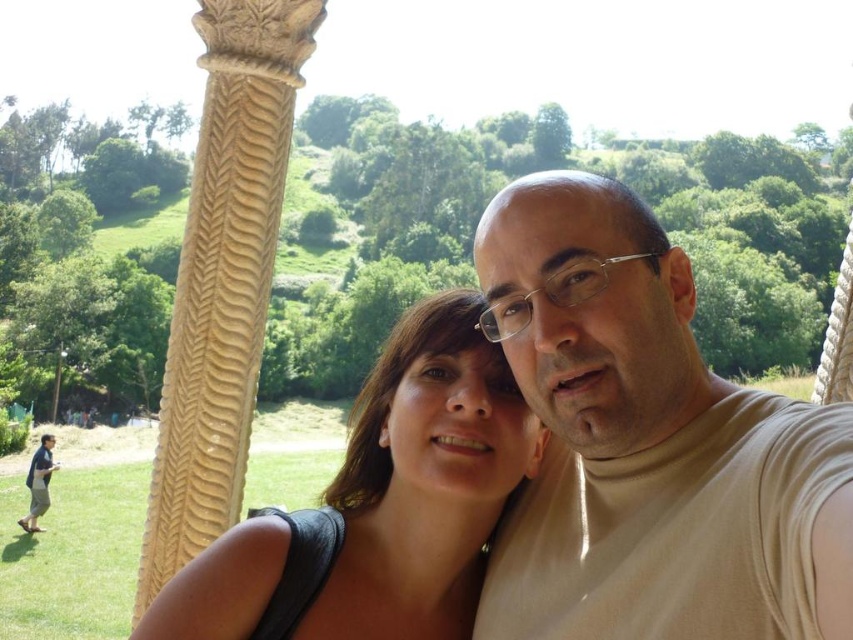
You are a photographer trying to adjust the lighting for a portrait. You notice the beige turtleneck at center and the blue denim jeans at lower left in the scene. Which clothing item requires more careful lighting adjustments due to its smaller size?

The beige turtleneck at center requires more careful lighting adjustments because it has a smaller size compared to the blue denim jeans at lower left, making it more challenging to highlight details in a smaller area.

You are a photographer trying to frame a shot of the beige turtleneck at center and the blue denim jeans at lower left. Which object should you focus on first if you want to capture both in the same frame without zooming in or out?

The beige turtleneck at center has a lesser width compared to blue denim jeans at lower left, so you should focus on the blue denim jeans at lower left first as it is wider and requires more space in the frame.

Where is the matte black hair at center located in the image?

The matte black hair at center is located at point 0.789 on the x axis and 0.447 on the y axis.